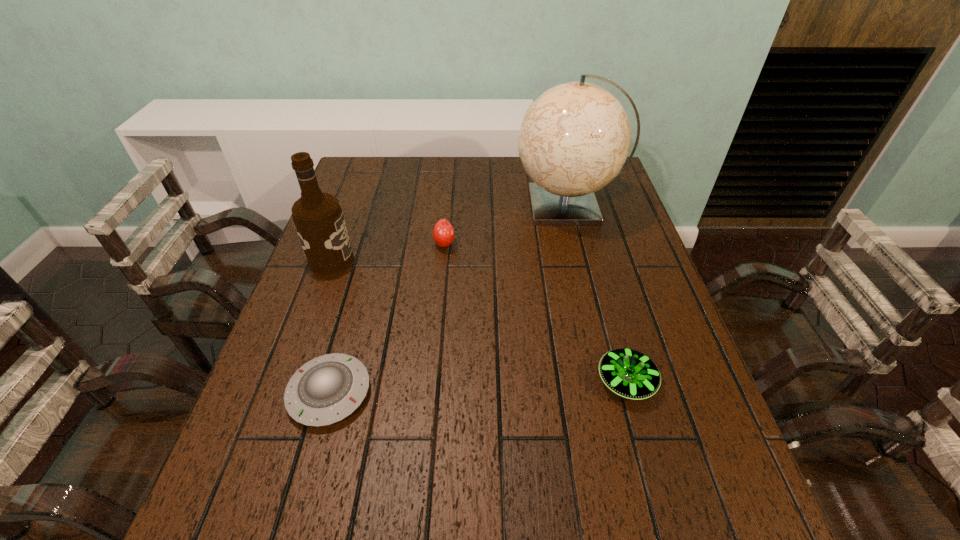
Identify the location of empty space that is in between the third tallest object and the shorter saucer. The width and height of the screenshot is (960, 540). (387, 318).

Identify the location of free space between the tallest object and the apple. (506, 225).

This screenshot has height=540, width=960. I want to click on vacant area that lies between the globe and the fourth tallest object, so click(x=597, y=293).

I want to click on object that ranks as the closest to the globe, so click(x=443, y=233).

Where is `object that ranks as the third closest to the right saucer`? This screenshot has height=540, width=960. object that ranks as the third closest to the right saucer is located at coordinates tap(325, 390).

I want to click on vacant space that satisfies the following two spatial constraints: 1. on the label of the second tallest object; 2. on the back side of the left saucer, so click(283, 393).

Identify the location of vacant position in the image that satisfies the following two spatial constraints: 1. on the label of the taller saucer; 2. on the left side of the alcohol. (287, 381).

At what (x,y) coordinates should I click in order to perform the action: click on vacant space that satisfies the following two spatial constraints: 1. on the surface of the tallest object showing Europe and Africa; 2. on the back side of the taller saucer. Please return your answer as a coordinate pair (x, y). This screenshot has width=960, height=540. Looking at the image, I should click on (611, 381).

Locate an element on the screen. The image size is (960, 540). free point that satisfies the following two spatial constraints: 1. on the back side of the second shortest object; 2. on the surface of the globe showing Europe and Africa is located at coordinates (578, 206).

Identify the location of vacant region that satisfies the following two spatial constraints: 1. on the surface of the globe showing Europe and Africa; 2. on the front side of the apple. (577, 244).